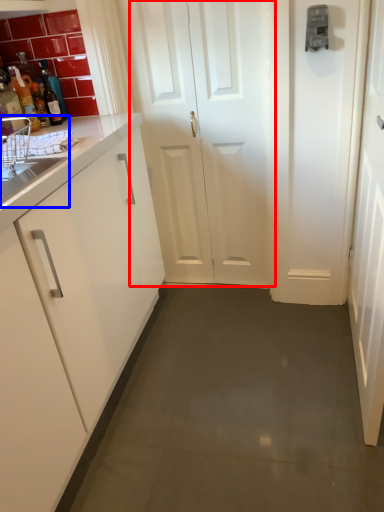
Question: Which object appears closest to the camera in this image, door (highlighted by a red box) or sink (highlighted by a blue box)?

Choices:
 (A) door
 (B) sink

Answer: (B)